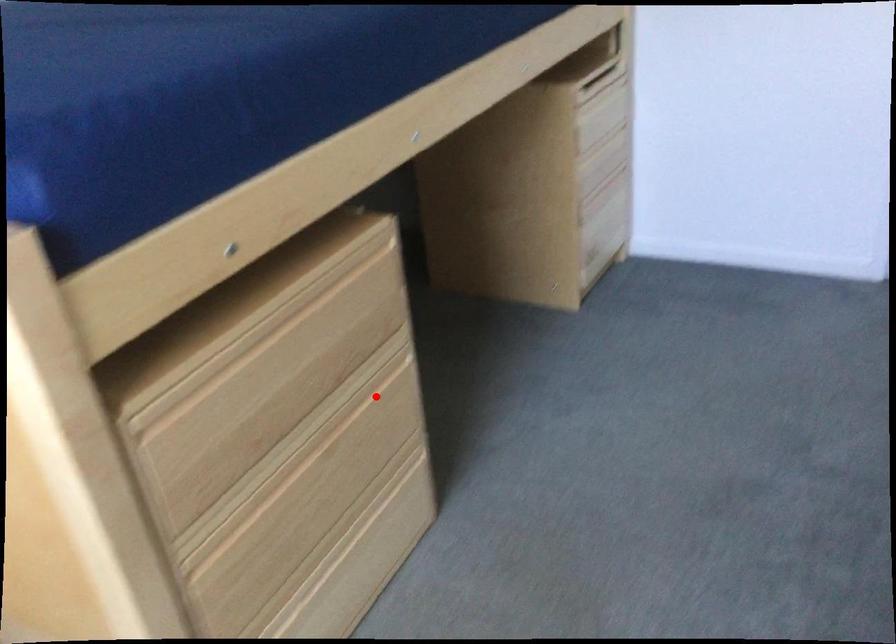
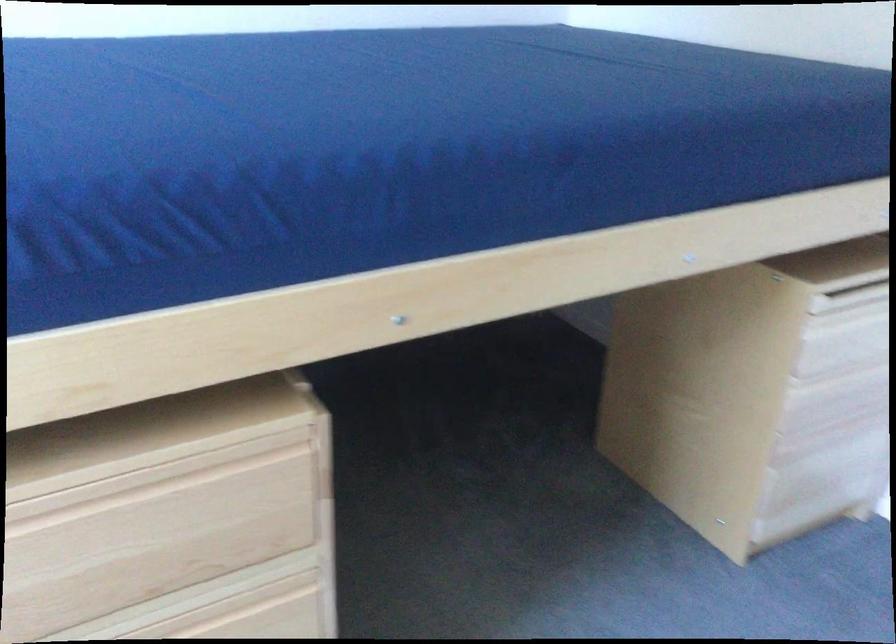
Where in the second image is the point corresponding to the highlighted location from the first image?

(253, 614)